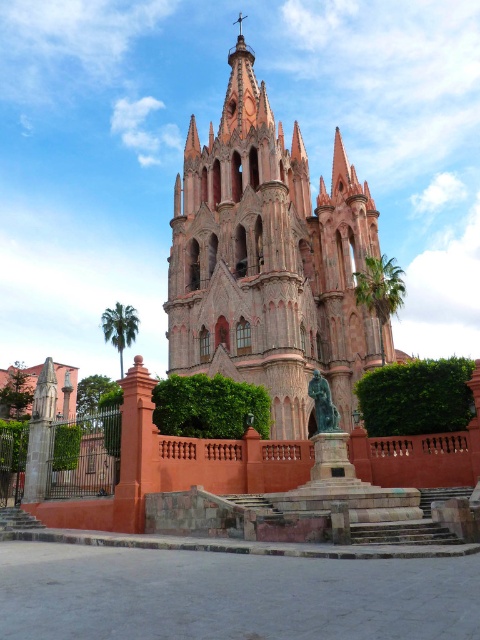
You are a visitor approaching the red brick church at center and the bronze statue at center. Based on their positions, which one would you encounter first as you walk towards the entrance?

The bronze statue at center is encountered first because it is positioned below the red brick church at center, meaning it is closer to the entrance path.

You are an architect visiting the site and need to determine if the bronze statue at center can be moved closer to the red brick church at center without appearing too small in relation to the building. Based on their sizes, is this feasible?

The red brick church at center has a larger size compared to bronze statue at center, so moving the statue closer would make it appear proportionally smaller relative to the church, which might make it look too small. Therefore, it is not advisable to move it closer.